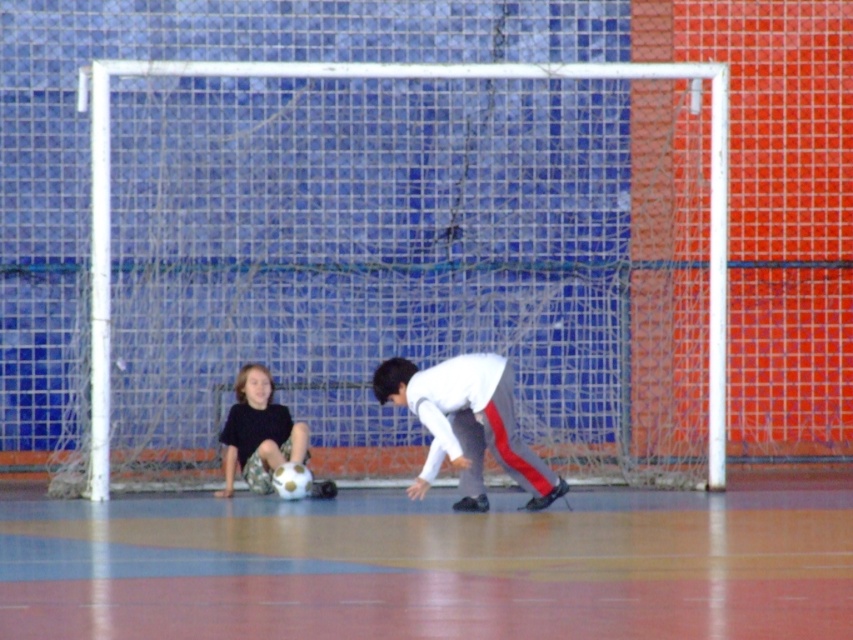
You are standing in the indoor soccer area and want to place a new decoration between the two points marked as point (723, 269) and point (538, 499). Which point is closer to you so you can start placing the decoration from there?

Point (723, 269) is closer to you than point (538, 499) because it is further to the viewer, so you should start placing the decoration from point (723, 269).

You are a soccer player standing at the origin point of the field. You need to place a new netting at the same location as the existing white mesh netting at center. What coordinates should you use?

The white mesh netting at center is located at coordinates point (392, 77), so you should place the new netting at those coordinates.